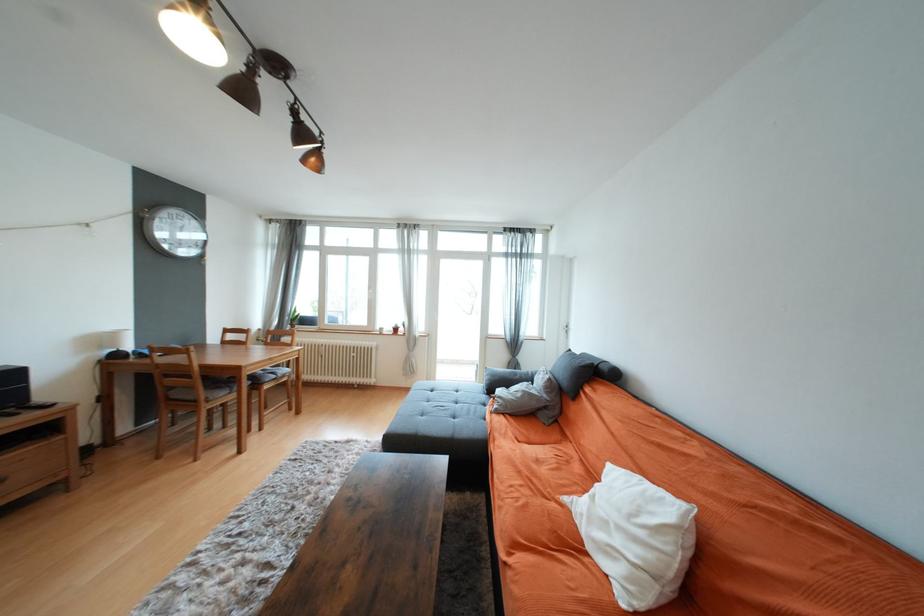
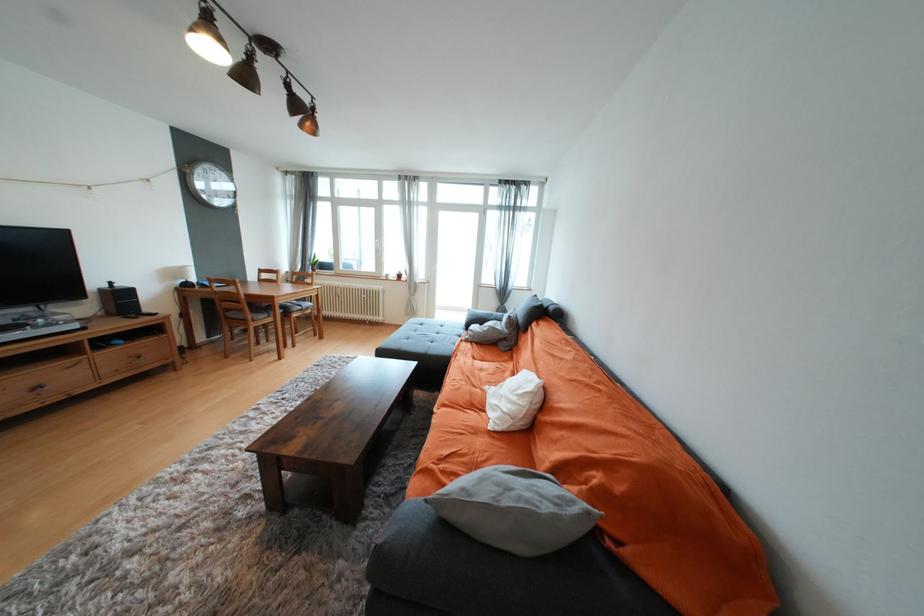
Locate, in the second image, the point that corresponds to the point at 525,442 in the first image.

(480, 360)